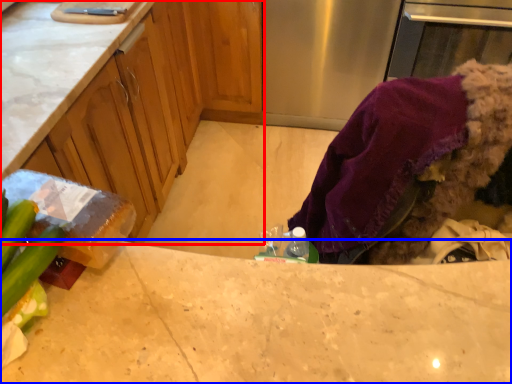
Question: Which object appears closest to the camera in this image, cabinetry (highlighted by a red box) or countertop (highlighted by a blue box)?

Choices:
 (A) cabinetry
 (B) countertop

Answer: (B)